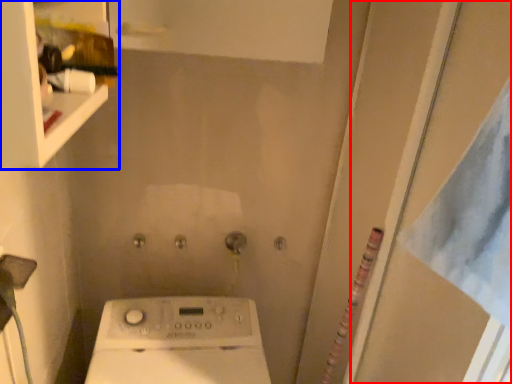
Question: Which object is further to the camera taking this photo, screen door (highlighted by a red box) or shelf (highlighted by a blue box)?

Choices:
 (A) screen door
 (B) shelf

Answer: (A)